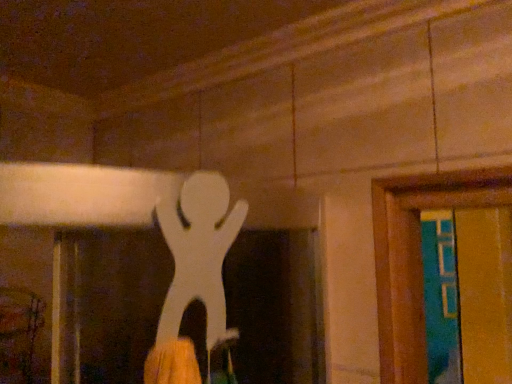
You are a GUI agent. You are given a task and a screenshot of the screen. Output one action in this format:
    pyautogui.click(x=<x>, y=<y>)
    Task: Click on the white paper man at center
    This screenshot has height=384, width=512.
    Given the screenshot: What is the action you would take?
    pyautogui.click(x=195, y=277)

Describe the element at coordinates (195, 277) in the screenshot. I see `white paper man at center` at that location.

The height and width of the screenshot is (384, 512). I want to click on white paper man at center, so click(195, 277).